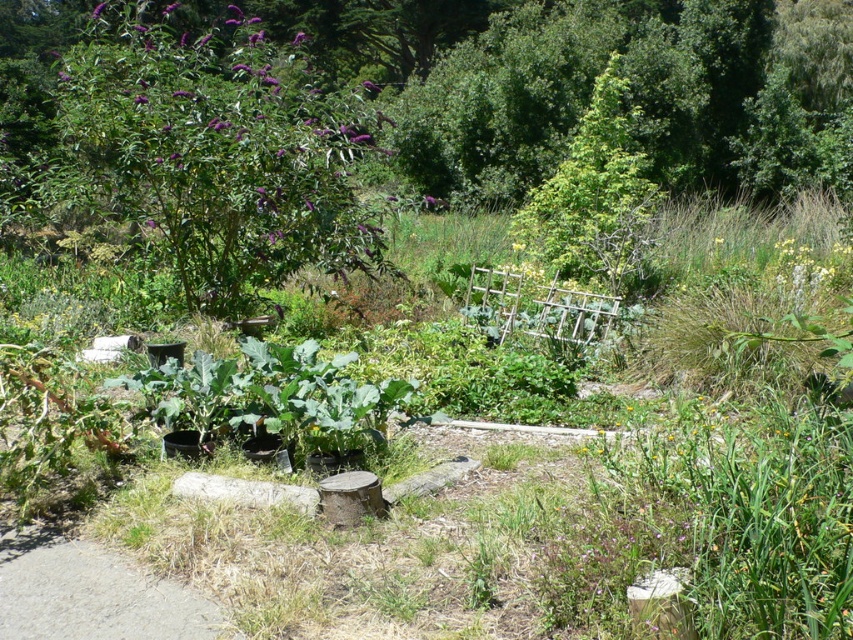
You are standing in the garden and want to walk from point A to point B. Point A is at coordinate point (318,141) and point B is at coordinate point (100,588). Since you can only move forward, will you be moving towards or away from the background trees when going from point A to point B?

Since point A at coordinate point (318,141) is closer to the viewer than point B at coordinate point (100,588), moving from A to B means you are moving away from the background trees.

You are a gardener planning to install a new flower bed. You have two options for locations in the garden scene shown. One is near the purple leafy bush at upper left, and the other is near the gray asphalt path at lower left. Based on their sizes, which location would provide more space for planting?

The purple leafy bush at upper left has a larger size compared to the gray asphalt path at lower left, so the area near the purple leafy bush at upper left would provide more space for planting.

Looking at this image, you are a gardener standing at the edge of the garden. You want to walk from the gray asphalt path at lower left to the green leafy tree at upper center. Which direction should you move to get closer to the tree?

To get closer to the green leafy tree at upper center, you should move towards it from the gray asphalt path at lower left since the tree is further away from you than the path.